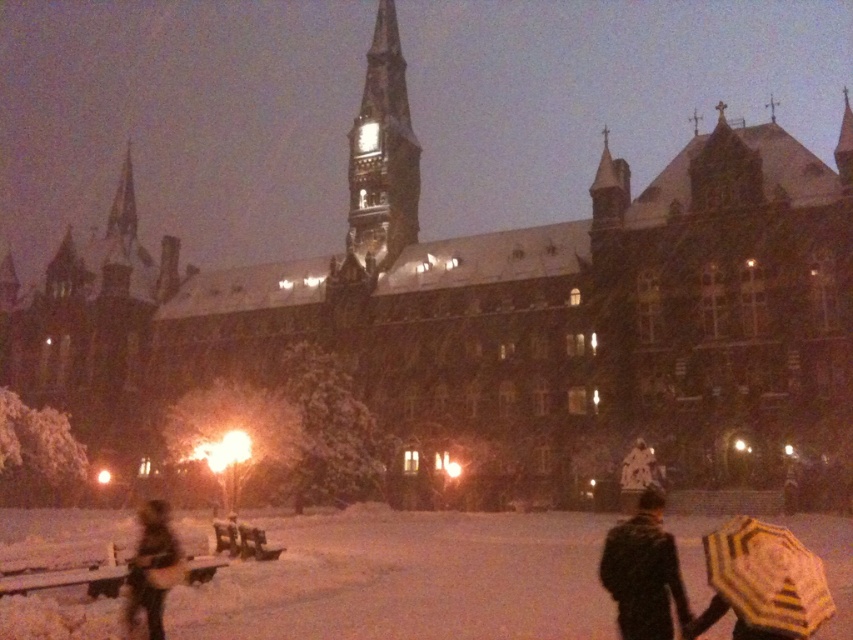
Is dark gray stone clock tower at center to the right of dark brown leather jacket at lower left from the viewer's perspective?

Yes, dark gray stone clock tower at center is to the right of dark brown leather jacket at lower left.

What do you see at coordinates (381, 154) in the screenshot? This screenshot has width=853, height=640. I see `dark gray stone clock tower at center` at bounding box center [381, 154].

Who is more distant from viewer, [401,65] or [143,602]?

Positioned behind is point [401,65].

The height and width of the screenshot is (640, 853). Find the location of `dark gray stone clock tower at center`. dark gray stone clock tower at center is located at coordinates (381, 154).

Between dark gray stone clock tower at center and yellow striped fabric umbrella at lower right, which one is positioned higher?

dark gray stone clock tower at center is above.

Is dark gray stone clock tower at center below yellow striped fabric umbrella at lower right?

No.

Find the location of a particular element. dark gray stone clock tower at center is located at coordinates (381, 154).

Is yellow striped fabric umbrella at lower right in front of dark textured coat at lower right?

Yes, it is in front of dark textured coat at lower right.

Does yellow striped fabric umbrella at lower right appear under dark textured coat at lower right?

Actually, yellow striped fabric umbrella at lower right is above dark textured coat at lower right.

Between point (701, 538) and point (630, 580), which one is positioned in front?

Point (630, 580)

You are a GUI agent. You are given a task and a screenshot of the screen. Output one action in this format:
    pyautogui.click(x=<x>, y=<y>)
    Task: Click on the yellow striped fabric umbrella at lower right
    
    Given the screenshot: What is the action you would take?
    pyautogui.click(x=767, y=577)